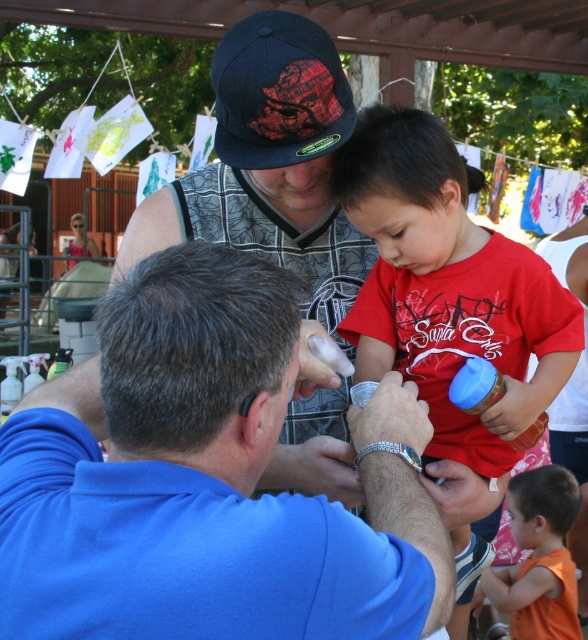
Is point (439, 268) in front of point (316, 64)?

That is False.

Is matte red shirt at center shorter than black matte baseball cap at upper center?

In fact, matte red shirt at center may be taller than black matte baseball cap at upper center.

Identify the location of matte red shirt at center. (447, 288).

I want to click on matte red shirt at center, so click(x=447, y=288).

Measure the distance between matte black cap at upper center and orange cotton shirt at lower right.

matte black cap at upper center and orange cotton shirt at lower right are 7.94 feet apart from each other.

Does matte black cap at upper center appear under orange cotton shirt at lower right?

Actually, matte black cap at upper center is above orange cotton shirt at lower right.

What do you see at coordinates (269, 164) in the screenshot?
I see `matte black cap at upper center` at bounding box center [269, 164].

Identify the location of matte black cap at upper center. This screenshot has width=588, height=640. (269, 164).

Does blue fabric shirt at center appear on the right side of matte red shirt at center?

Incorrect, blue fabric shirt at center is not on the right side of matte red shirt at center.

Who is more distant from viewer, [345,632] or [433,422]?

Point [433,422]

Find the location of a particular element. This screenshot has width=588, height=640. blue fabric shirt at center is located at coordinates (202, 484).